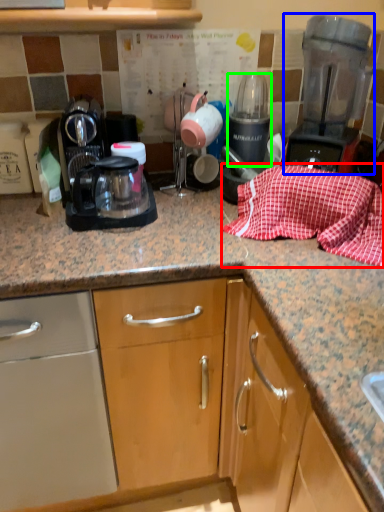
Question: Estimate the real-world distances between objects in this image. Which object is farther from blanket (highlighted by a red box), home appliance (highlighted by a blue box) or appliance (highlighted by a green box)?

Choices:
 (A) home appliance
 (B) appliance

Answer: (B)